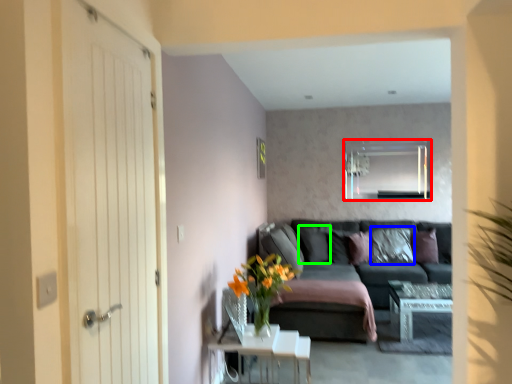
Question: Considering the real-world distances, which object is closest to mirror (highlighted by a red box)? pillow (highlighted by a blue box) or pillow (highlighted by a green box).

Choices:
 (A) pillow
 (B) pillow

Answer: (A)